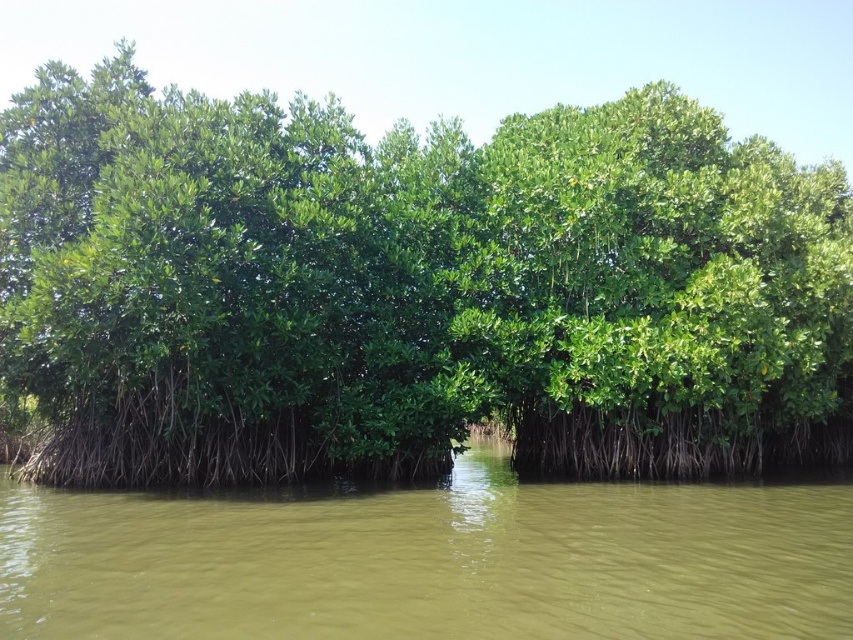
Is green leafy mangrove at center to the right of green muddy water at center from the viewer's perspective?

Incorrect, green leafy mangrove at center is not on the right side of green muddy water at center.

Which is in front, point (170, 417) or point (196, 499)?

Positioned in front is point (196, 499).

Is point (608, 284) in front of point (462, 529)?

No.

At what (x,y) coordinates should I click in order to perform the action: click on green leafy mangrove at center. Please return your answer as a coordinate pair (x, y). Image resolution: width=853 pixels, height=640 pixels. Looking at the image, I should click on click(x=412, y=289).